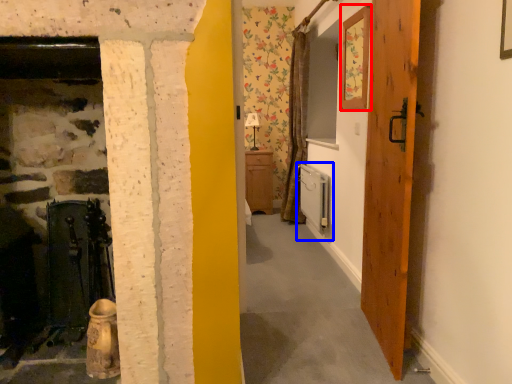
Question: Which object appears farthest to the camera in this image, picture frame (highlighted by a red box) or appliance (highlighted by a blue box)?

Choices:
 (A) picture frame
 (B) appliance

Answer: (B)